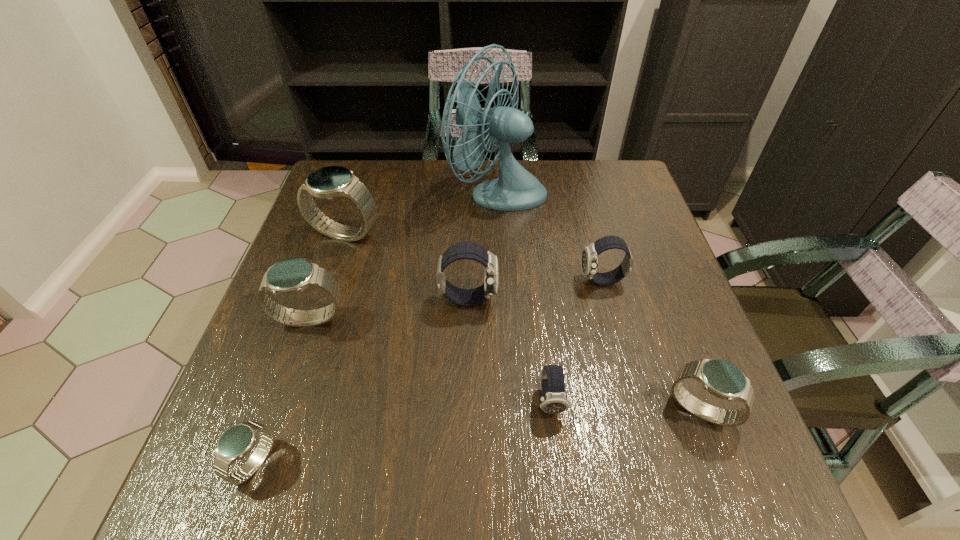
You are a GUI agent. You are given a task and a screenshot of the screen. Output one action in this format:
    pyautogui.click(x=<x>, y=<y>)
    Task: Click on the vacant space located 0.310m on the face of the second smallest dark watch
    
    Given the screenshot: What is the action you would take?
    pyautogui.click(x=444, y=281)

Find the location of `vacant space located 0.220m on the face of the second smallest dark watch`. vacant space located 0.220m on the face of the second smallest dark watch is located at coordinates (484, 281).

Identify the location of vacant space positioned 0.220m on the left of the rightmost watch. This screenshot has height=540, width=960. (543, 410).

Image resolution: width=960 pixels, height=540 pixels. I want to click on vacant region located 0.050m on the face of the second dark watch from right to left, so click(556, 449).

Where is `free space located 0.340m on the back of the smallest blue watch`? Image resolution: width=960 pixels, height=540 pixels. free space located 0.340m on the back of the smallest blue watch is located at coordinates (316, 289).

I want to click on object located in the far edge section of the desktop, so click(516, 189).

Identify the location of object at the near edge. This screenshot has height=540, width=960. (237, 441).

Where is `object positioned at the near left corner`? This screenshot has width=960, height=540. object positioned at the near left corner is located at coordinates (237, 441).

In the image, there is a desktop. At what (x,y) coordinates should I click in order to perform the action: click on vacant space at the far edge. Please return your answer as a coordinate pair (x, y). Looking at the image, I should click on (449, 191).

This screenshot has height=540, width=960. Identify the location of vacant position at the near edge of the desktop. (581, 508).